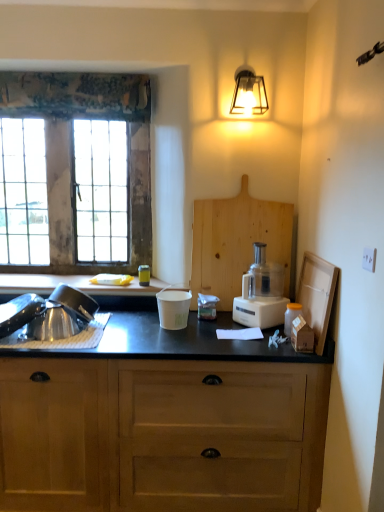
Where is `vacant area that is situated to the right of brushed metal sink at lower left`? This screenshot has width=384, height=512. vacant area that is situated to the right of brushed metal sink at lower left is located at coordinates (130, 335).